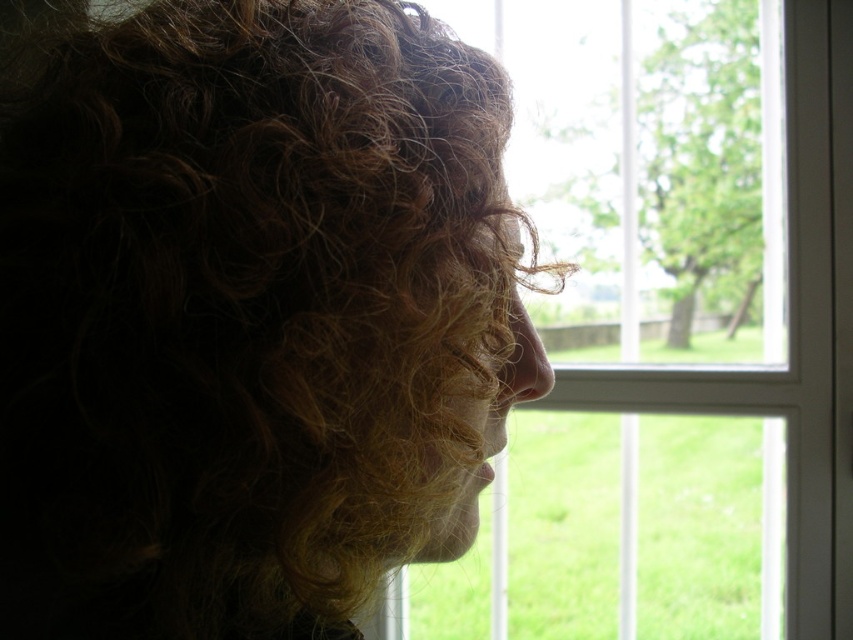
Between point (30, 196) and point (819, 86), which one is positioned behind?

Positioned behind is point (819, 86).

What do you see at coordinates (248, 316) in the screenshot?
I see `curly golden hair at right` at bounding box center [248, 316].

At what (x,y) coordinates should I click in order to perform the action: click on curly golden hair at right. Please return your answer as a coordinate pair (x, y). The width and height of the screenshot is (853, 640). Looking at the image, I should click on (248, 316).